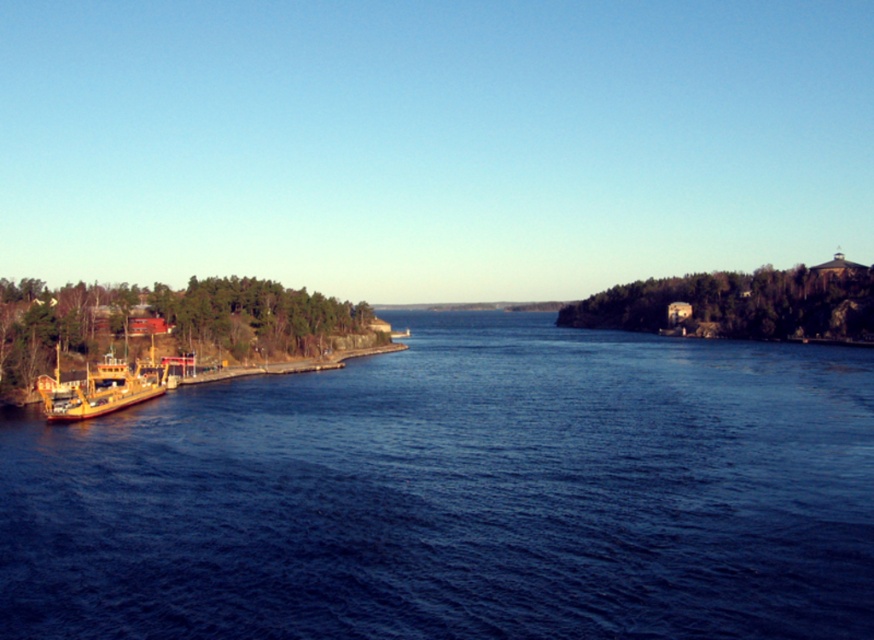
You are a tour guide planning a boat trip. You need to ensure that the yellow matte boat at left can safely navigate to the blue water at center. Given that the boat requires a minimum of 30 meters of clearance between its position and the destination, will there be enough space?

Answer: The blue water at center and yellow matte boat at left are 30.86 meters apart from each other. Since the boat requires a minimum of 30 meters of clearance, the distance is sufficient, so yes, there will be enough space.

You are a photographer planning to capture a sunset shot from the yellow matte boat at left. You want to ensure the blue water at center is visible in the reflection. Based on their relative heights, is the boat likely to block the reflection of the water? Explain your reasoning.

The blue water at center is not as tall as the yellow matte boat at left, meaning the boat is taller than the water. Since the boat is taller, it could potentially block the reflection of the water if positioned between the camera and the water surface. However, reflections depend on the angle and positioning, so adjusting the camera angle might still allow capturing the reflection despite the boat height.